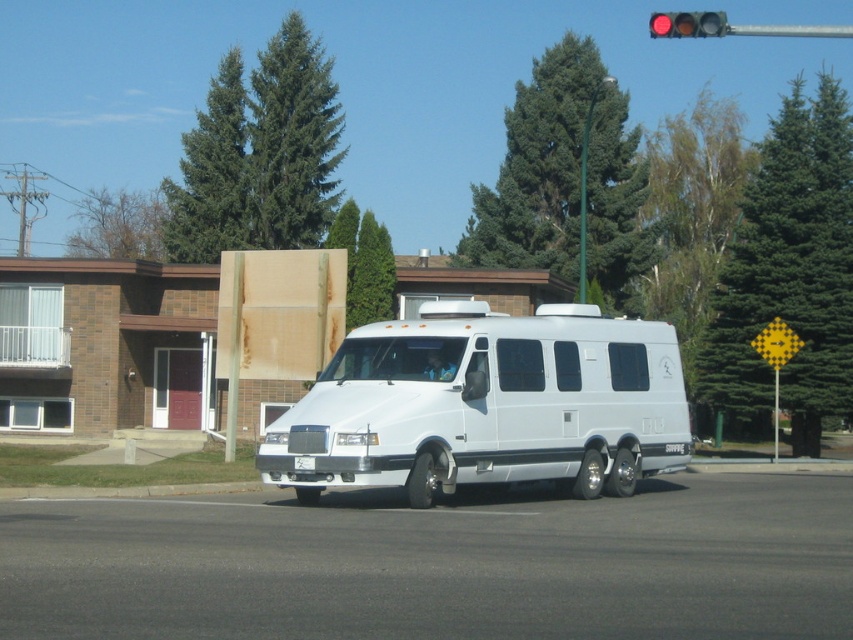
Between white matte van at center and red glass traffic light at upper center, which one has less height?

white matte van at center

Does white matte van at center have a lesser height compared to red glass traffic light at upper center?

Indeed, white matte van at center has a lesser height compared to red glass traffic light at upper center.

Who is more forward, (608,452) or (694,35)?

Point (608,452)

Find the location of `white matte van at center`. white matte van at center is located at coordinates click(x=486, y=404).